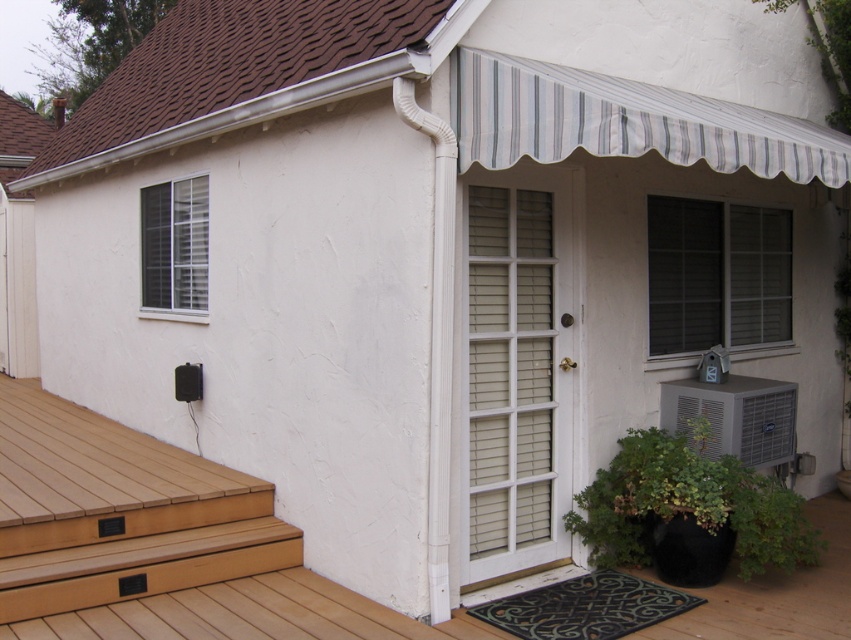
Question: Which of the following is the closest to the observer?

Choices:
 (A) white textured screen door at center
 (B) white textured shutters at left
 (C) light brown wood stairs at lower left
 (D) white textured shutter at right

Answer: (C)

Question: Is white textured shutter at right bigger than white textured air conditioner at lower right?

Choices:
 (A) yes
 (B) no

Answer: (A)

Question: Which is nearer to the white textured air conditioner at lower right?

Choices:
 (A) white textured screen door at center
 (B) white textured shutter at right

Answer: (B)

Question: Can you confirm if light brown wood stairs at lower left is thinner than white textured shutters at left?

Choices:
 (A) yes
 (B) no

Answer: (B)

Question: Which object appears farthest from the camera in this image?

Choices:
 (A) light brown wood stairs at lower left
 (B) white textured shutters at left
 (C) white textured shutter at right
 (D) white textured air conditioner at lower right

Answer: (B)

Question: Is white textured screen door at center closer to camera compared to light brown wood stairs at lower left?

Choices:
 (A) yes
 (B) no

Answer: (B)